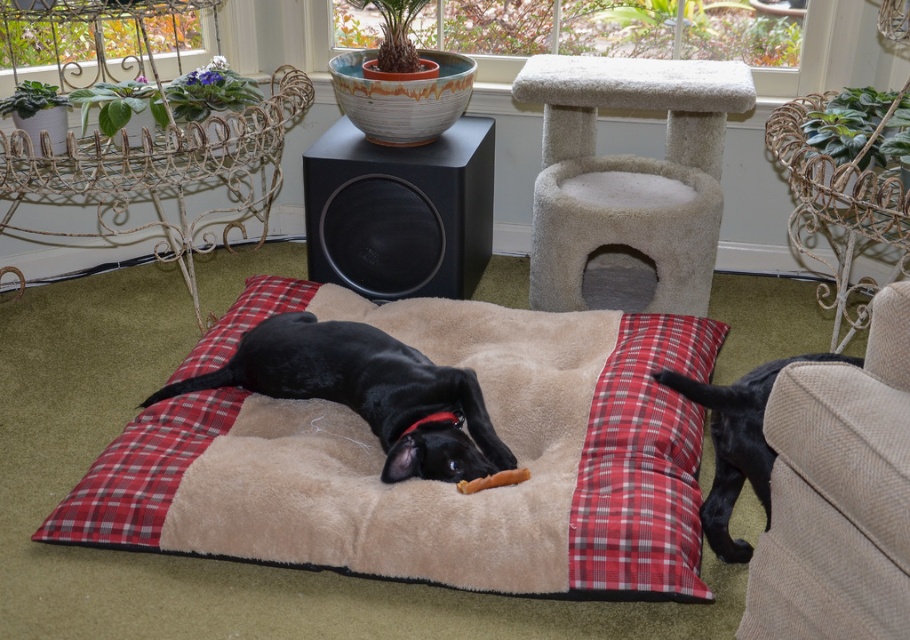
You are a delivery person who needs to place a new rectangular package that is 10 cm thick on the surface where the black matte speaker at center is currently located. Can the package fit in terms of thickness without overlapping the black soft fur dog at center?

The black matte speaker at center is thinner than the black soft fur dog at center. Since the package is 10 cm thick, and the speaker is thinner than the dog, but we donot know the exact thickness of the speaker or the dog. Therefore, it is uncertain whether the package will fit without overlapping the dog.

You are a dog owner who wants to place a new rectangular dog bed that is 20 cm tall. The bed must be placed in the room where the red plaid pillow at lower center and black soft fur dog at center are located. Can the new dog bed fit vertically between the two objects without exceeding their heights?

The red plaid pillow at lower center has a greater height compared to the black soft fur dog at center. Since the new dog bed is 20 cm tall, it depends on the actual height of the pillow. If the pillow is taller than 20 cm, the bed can fit below it. However, without specific measurements, we cannot confirm. Please ensure the pillow is taller than 20 cm.

You are a cat owner who wants to place your cat on the beige carpeted cat tree at center and the black matte speaker at center. If your cat is 12 inches long, can it comfortably lie across both objects at the same time?

The beige carpeted cat tree at center is 19.09 inches from the black matte speaker at center. Since the cat is only 12 inches long, it can comfortably lie across both objects as the distance between them is greater than the cat length.